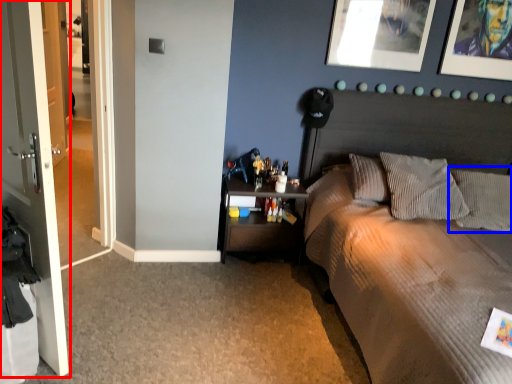
Question: Which of the following is the farthest to the observer, door (highlighted by a red box) or pillow (highlighted by a blue box)?

Choices:
 (A) door
 (B) pillow

Answer: (B)